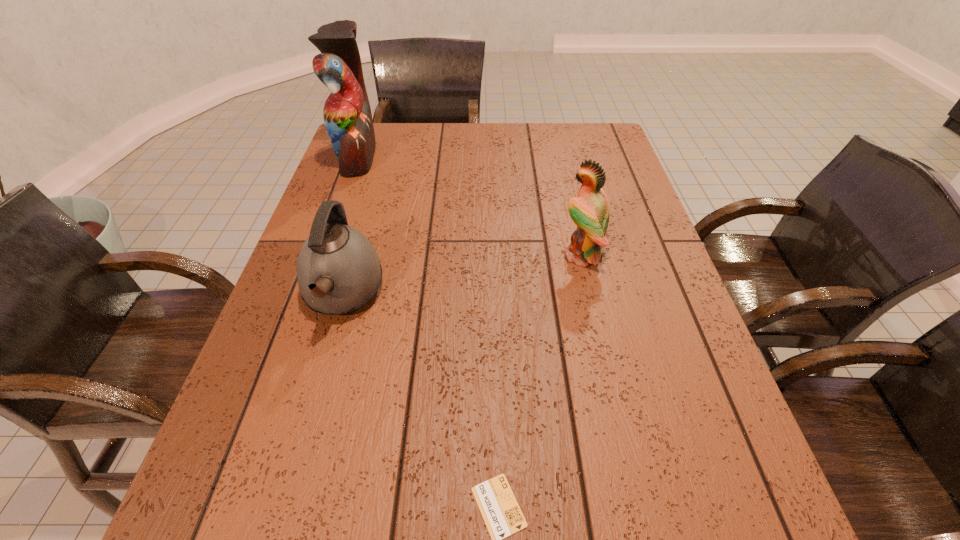
Where is `free space between the nearer parrot and the kettle`? Image resolution: width=960 pixels, height=540 pixels. free space between the nearer parrot and the kettle is located at coordinates (462, 275).

The height and width of the screenshot is (540, 960). In order to click on vacant area that lies between the third shortest object and the second shortest object in this screenshot , I will do `click(462, 275)`.

Find the location of a particular element. The image size is (960, 540). vacant area that lies between the right parrot and the farthest object is located at coordinates click(x=469, y=206).

Select which object appears as the closest to the taller parrot. Please provide its 2D coordinates. Your answer should be formatted as a tuple, i.e. [(x, y)], where the tuple contains the x and y coordinates of a point satisfying the conditions above.

[(338, 270)]

Image resolution: width=960 pixels, height=540 pixels. I want to click on object that is the second closest one to the second shortest object, so click(502, 515).

Where is `free spot that satisfies the following two spatial constraints: 1. on the front-facing side of the shorter parrot; 2. at the spout of the second shortest object`? free spot that satisfies the following two spatial constraints: 1. on the front-facing side of the shorter parrot; 2. at the spout of the second shortest object is located at coordinates (590, 294).

Where is `vacant space that satisfies the following two spatial constraints: 1. on the front-facing side of the rightmost object; 2. at the spout of the second shortest object`? The image size is (960, 540). vacant space that satisfies the following two spatial constraints: 1. on the front-facing side of the rightmost object; 2. at the spout of the second shortest object is located at coordinates (590, 294).

Where is `vacant area in the image that satisfies the following two spatial constraints: 1. on the front-facing side of the rightmost object; 2. at the spout of the third tallest object`? Image resolution: width=960 pixels, height=540 pixels. vacant area in the image that satisfies the following two spatial constraints: 1. on the front-facing side of the rightmost object; 2. at the spout of the third tallest object is located at coordinates (590, 294).